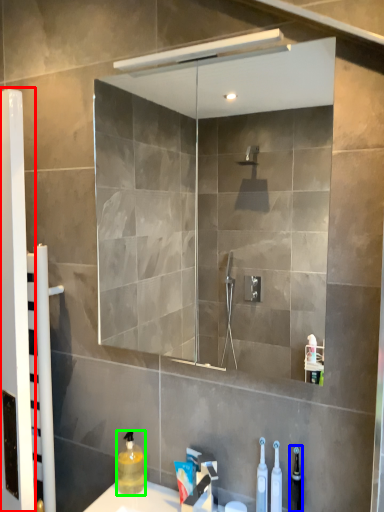
Question: Considering the real-world distances, which object is farthest from screen door (highlighted by a red box)? toiletry (highlighted by a blue box) or cleaning product (highlighted by a green box)?

Choices:
 (A) toiletry
 (B) cleaning product

Answer: (A)